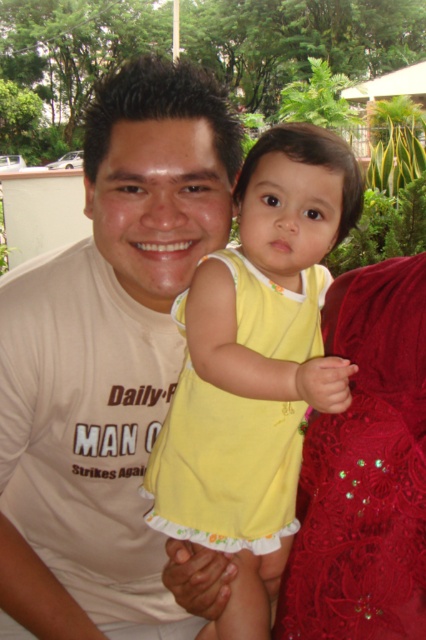
Question: Where is yellow fabric dress at center located in relation to velvet red dress at right in the image?

Choices:
 (A) right
 (B) left

Answer: (B)

Question: Estimate the real-world distances between objects in this image. Which object is farther from the yellow fabric dress at center?

Choices:
 (A) matte beige t-shirt at center
 (B) velvet red dress at right

Answer: (A)

Question: Does matte beige t-shirt at center appear on the left side of yellow fabric dress at center?

Choices:
 (A) no
 (B) yes

Answer: (B)

Question: Does yellow fabric dress at center have a greater width compared to velvet red dress at right?

Choices:
 (A) no
 (B) yes

Answer: (B)

Question: Based on their relative distances, which object is farther from the matte beige t-shirt at center?

Choices:
 (A) yellow fabric dress at center
 (B) velvet red dress at right

Answer: (B)

Question: Which of the following is the closest to the observer?

Choices:
 (A) yellow fabric dress at center
 (B) matte beige t-shirt at center
 (C) velvet red dress at right

Answer: (A)